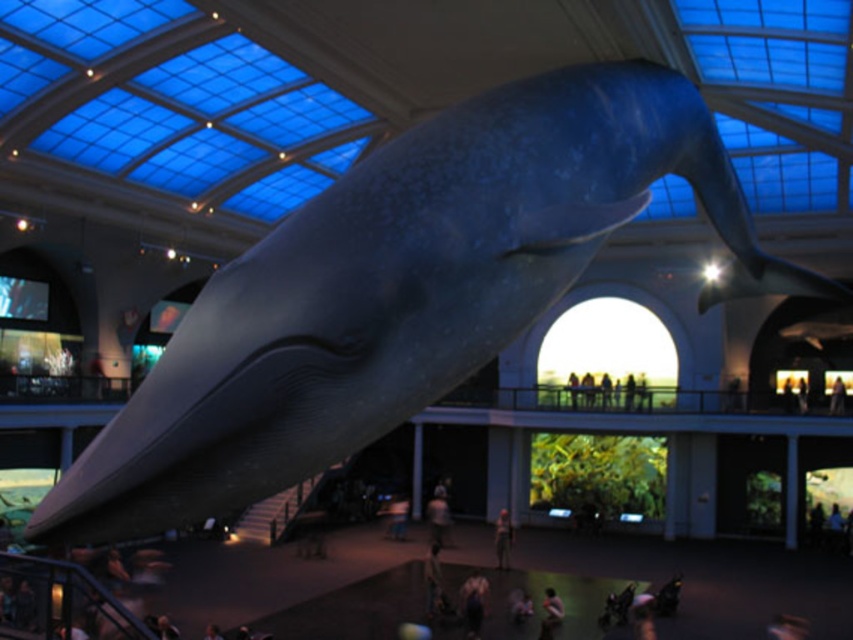
Can you confirm if dark gray fabric pants at center is positioned below smooth skin person at lower center?

Indeed, dark gray fabric pants at center is positioned under smooth skin person at lower center.

In the scene shown: Is dark gray fabric pants at center to the right of smooth skin person at lower center from the viewer's perspective?

No, dark gray fabric pants at center is not to the right of smooth skin person at lower center.

Is point (498, 556) positioned behind point (541, 634)?

Yes, it is behind point (541, 634).

I want to click on dark gray fabric pants at center, so click(x=502, y=538).